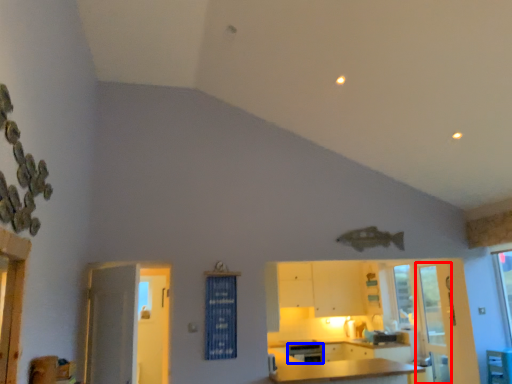
Question: Which of the following is the closest to the observer, screen door (highlighted by a red box) or dish washer (highlighted by a blue box)?

Choices:
 (A) screen door
 (B) dish washer

Answer: (A)